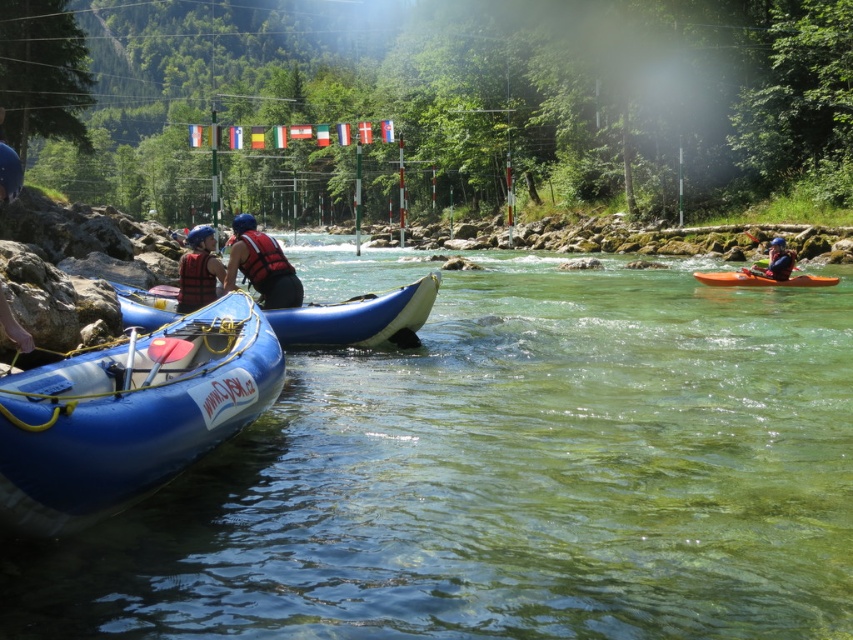
Which is more to the left, matte red life jacket at left or matte blue kayak at right?

From the viewer's perspective, matte red life jacket at left appears more on the left side.

Which is in front, point (189, 259) or point (782, 243)?

Point (189, 259) is more forward.

In order to click on matte red life jacket at left in this screenshot , I will do coord(195,280).

Based on the photo, between clear plastic water at center and orange matte kayak at right, which one appears on the right side from the viewer's perspective?

orange matte kayak at right is more to the right.

Between clear plastic water at center and orange matte kayak at right, which one has less height?

With less height is orange matte kayak at right.

Who is more forward, [814,579] or [793,284]?

Point [814,579]

Where is `clear plastic water at center`? clear plastic water at center is located at coordinates (506, 477).

Does blue rubber boat at lower left have a lesser width compared to matte red life vest at center?

In fact, blue rubber boat at lower left might be wider than matte red life vest at center.

This screenshot has width=853, height=640. I want to click on blue rubber boat at lower left, so click(131, 413).

Where is `blue rubber boat at lower left`? Image resolution: width=853 pixels, height=640 pixels. blue rubber boat at lower left is located at coordinates (131, 413).